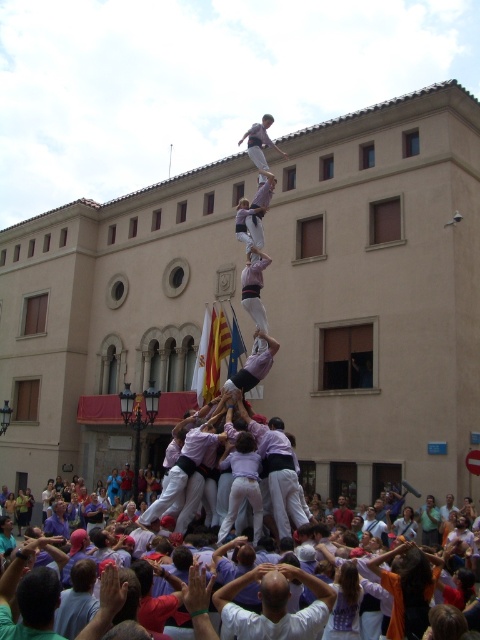
You are a photographer standing in front of the beige building with the arched windows. You want to take a photo of the human tower. Which of the two shirts, the white cotton shirt at center or the light purple shirt at center, would appear smaller in the photo?

The white cotton shirt at center occupies less space than the light purple shirt at center, so it would appear smaller in the photo.

You are a photographer standing in front of the beige building. You want to take a photo of the human tower. The white cotton shirt at center and the light purple shirt at center are both in your view. Which of these shirts appears narrower in the photo?

The white cotton shirt at center appears narrower in the photo because it has a lesser width compared to the light purple shirt at center.

In the scene shown: You are a photographer standing in front of the beige building and want to capture both the white cotton shirt at center and the light purple shirt at center in your photo. Which shirt will appear closer to the camera in the final image?

The white cotton shirt at center appears closer to the camera because it is positioned in front of the light purple shirt at center.